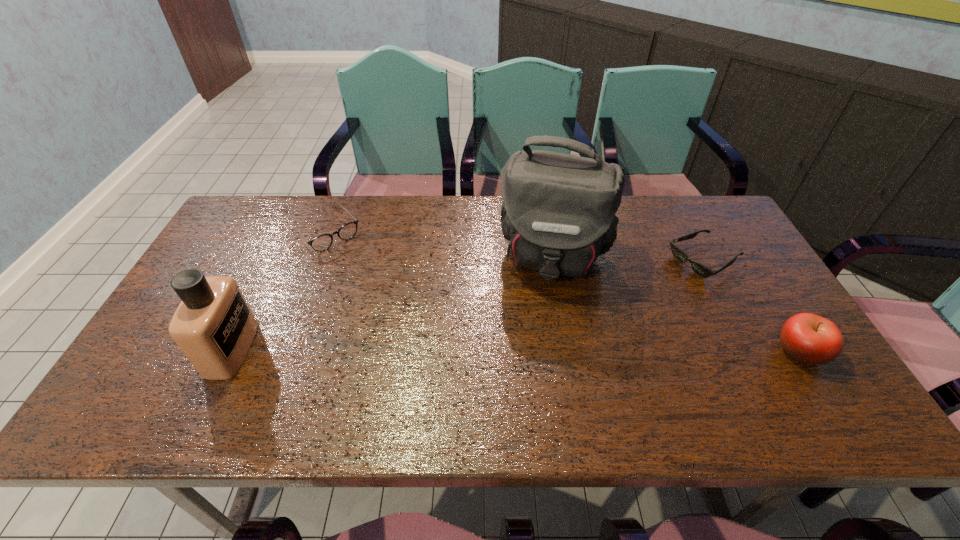
At what (x,y) coordinates should I click in order to perform the action: click on free space on the desktop that is between the perfume and the apple and is positioned through the lenses of the spectacles. Please return your answer as a coordinate pair (x, y). This screenshot has width=960, height=540. Looking at the image, I should click on (434, 350).

The width and height of the screenshot is (960, 540). Find the location of `free spot on the desktop that is between the perfume and the third tallest object and is positioned on the open flap of the third object from left to right`. free spot on the desktop that is between the perfume and the third tallest object and is positioned on the open flap of the third object from left to right is located at coordinates (538, 350).

Locate an element on the screen. Image resolution: width=960 pixels, height=540 pixels. vacant space on the desktop that is between the fourth shortest object and the third tallest object and is positioned on the front-facing side of the shortest object is located at coordinates (534, 350).